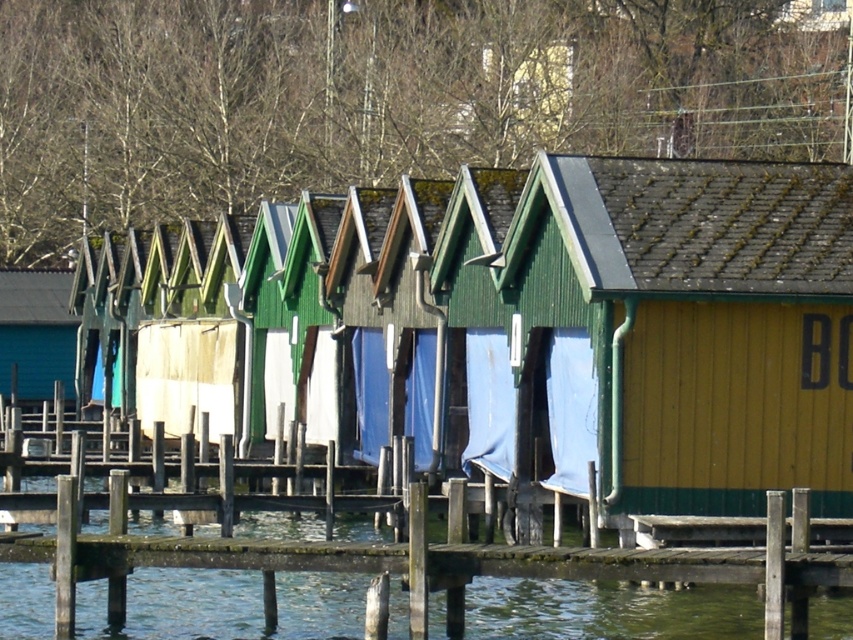
You need to place a 1.5 meter wide storage box on either the yellow wood cabin at right or the blue fabric at center. Which location can accommodate the storage box based on their widths?

The yellow wood cabin at right has a greater width than the blue fabric at center. Therefore, the storage box can fit on the yellow wood cabin at right but may not fit on the blue fabric at center due to its smaller width.